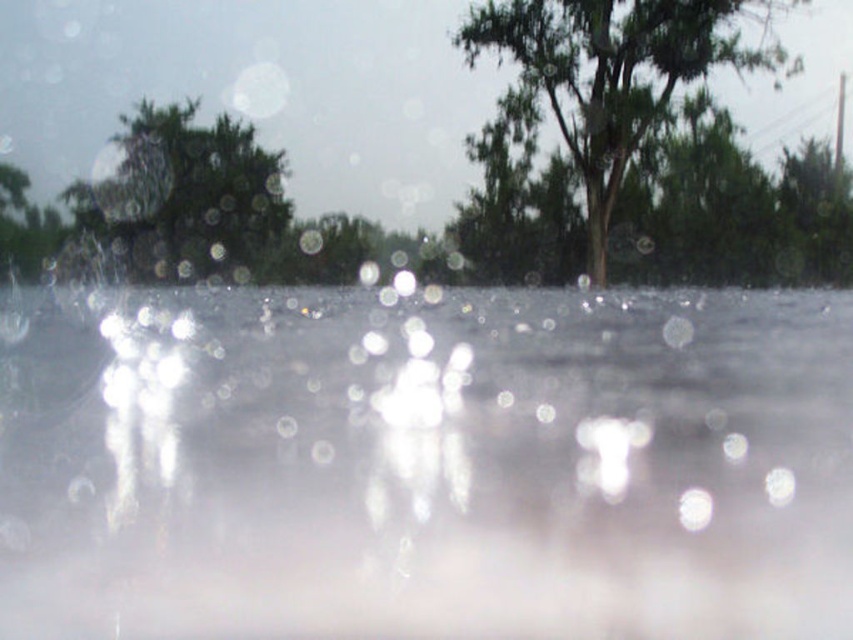
Question: Does green leafy tree at upper center appear under green matte tree at upper left?

Choices:
 (A) yes
 (B) no

Answer: (B)

Question: Which of the following is the farthest from the observer?

Choices:
 (A) green matte tree at upper left
 (B) transparent water at center
 (C) green leafy tree at upper center

Answer: (A)

Question: Is transparent water at center to the left of green matte tree at upper left from the viewer's perspective?

Choices:
 (A) yes
 (B) no

Answer: (B)

Question: Which object is farther from the camera taking this photo?

Choices:
 (A) transparent water at center
 (B) green leafy tree at upper center

Answer: (B)

Question: Is green leafy tree at upper center smaller than green matte tree at upper left?

Choices:
 (A) yes
 (B) no

Answer: (B)

Question: Which point appears closest to the camera in this image?

Choices:
 (A) (254, 253)
 (B) (573, 4)
 (C) (12, 593)

Answer: (C)